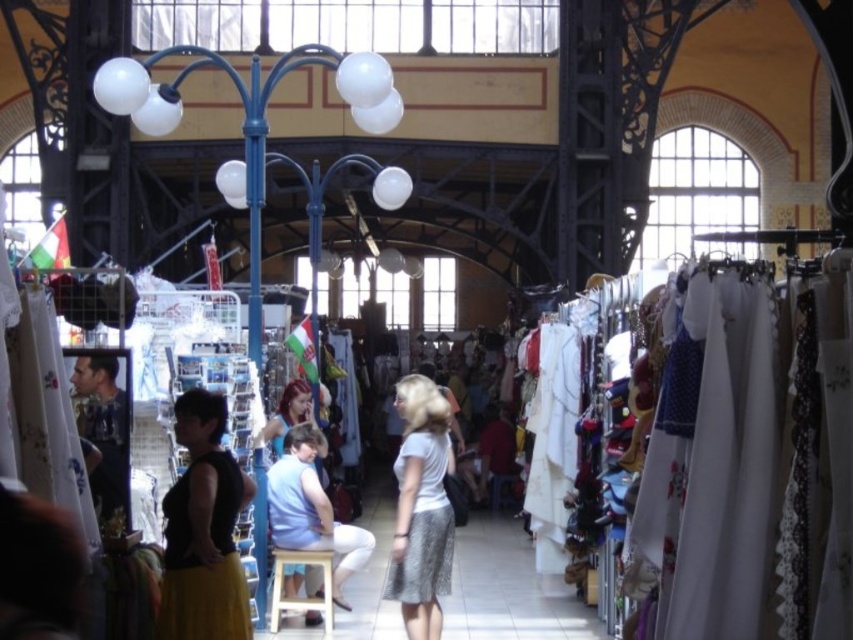
Question: Which point is farther to the camera?

Choices:
 (A) (315, 600)
 (B) (202, 570)
 (C) (351, 566)

Answer: (C)

Question: Which of the following is the farthest from the observer?

Choices:
 (A) (184, 396)
 (B) (280, 608)
 (C) (437, 502)

Answer: (C)

Question: Which object is farther from the camera taking this photo?

Choices:
 (A) light brown wooden stool at center
 (B) black matte tank top at center
 (C) white lace skirt at center

Answer: (A)

Question: Observing the image, what is the correct spatial positioning of black matte tank top at center in reference to light blue fabric at center?

Choices:
 (A) below
 (B) above

Answer: (B)

Question: In this image, where is black matte tank top at center located relative to white lace skirt at center?

Choices:
 (A) right
 (B) left

Answer: (B)

Question: Is white lace skirt at center positioned behind light blue fabric at center?

Choices:
 (A) no
 (B) yes

Answer: (A)